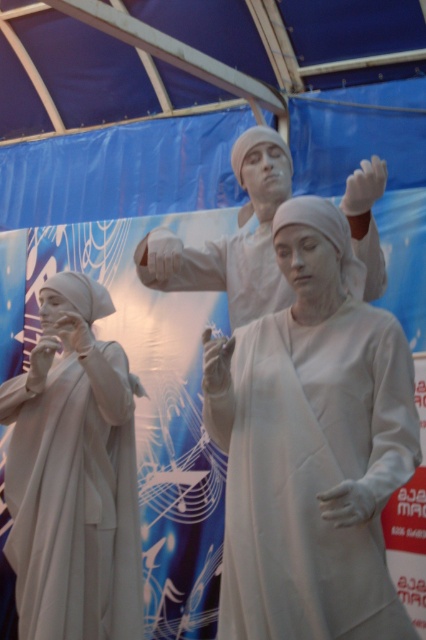
Question: Which of the following is the closest to the observer?

Choices:
 (A) matte white statue at center
 (B) white matte statue at left

Answer: (B)

Question: Can you confirm if white matte robe at center is positioned below matte white statue at center?

Choices:
 (A) yes
 (B) no

Answer: (A)

Question: Is white matte statue at left above matte white statue at center?

Choices:
 (A) yes
 (B) no

Answer: (B)

Question: Among these points, which one is nearest to the camera?

Choices:
 (A) (397, 480)
 (B) (281, 280)

Answer: (A)

Question: Where is white matte robe at center located in relation to white matte statue at left in the image?

Choices:
 (A) left
 (B) right

Answer: (B)

Question: Among these points, which one is nearest to the camera?

Choices:
 (A) (183, 275)
 (B) (247, 611)
 (C) (46, 323)

Answer: (B)